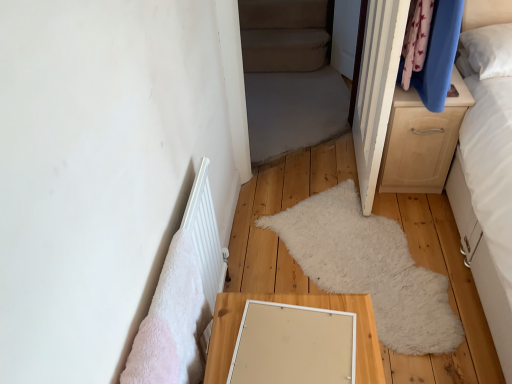
Where is `beige fabric bed at center`? beige fabric bed at center is located at coordinates (290, 76).

Where is `light wood/texture table at lower center`? This screenshot has height=384, width=512. light wood/texture table at lower center is located at coordinates tap(294, 304).

Image resolution: width=512 pixels, height=384 pixels. Describe the element at coordinates (206, 235) in the screenshot. I see `white matte radiator at lower left` at that location.

Find the location of a particular element. This screenshot has width=512, height=384. white wood door at upper right is located at coordinates (376, 89).

Measure the distance between point (428, 120) and camera.

A distance of 1.89 meters exists between point (428, 120) and camera.

This screenshot has width=512, height=384. What are the coordinates of `light wood/texture chest of drawers at right` in the screenshot? It's located at (421, 141).

Where is `wooden floor mat at center`? wooden floor mat at center is located at coordinates (448, 294).

Where is `white fluffy mat at center`? This screenshot has height=384, width=512. white fluffy mat at center is located at coordinates (369, 268).

Image resolution: width=512 pixels, height=384 pixels. I want to click on beige fabric bed at center, so click(290, 76).

Is white matte radiator at lower left wider than light wood/texture chest of drawers at right?

In fact, white matte radiator at lower left might be narrower than light wood/texture chest of drawers at right.

Is light wood/texture chest of drawers at right located within white matte radiator at lower left?

Definitely not — light wood/texture chest of drawers at right is not inside white matte radiator at lower left.

The width and height of the screenshot is (512, 384). I want to click on the chest of drawers lying above the white matte radiator at lower left (from the image's perspective), so click(x=421, y=141).

Which of these two, white matte radiator at lower left or light wood/texture chest of drawers at right, is bigger?

light wood/texture chest of drawers at right is bigger.

From a real-world perspective, between light wood/texture chest of drawers at right and white wood door at upper right, who is vertically lower?

In real-world perspective, light wood/texture chest of drawers at right is lower.

From the picture: Considering the relative positions of light wood/texture chest of drawers at right and white wood door at upper right in the image provided, is light wood/texture chest of drawers at right to the right of white wood door at upper right from the viewer's perspective?

Correct, you'll find light wood/texture chest of drawers at right to the right of white wood door at upper right.

Where is `the chest of drawers lying behind the white wood door at upper right`? The height and width of the screenshot is (384, 512). the chest of drawers lying behind the white wood door at upper right is located at coordinates (421, 141).

Considering the positions of objects white matte radiator at lower left and beige fabric bed at center in the image provided, who is more to the right, white matte radiator at lower left or beige fabric bed at center?

beige fabric bed at center.

Considering the relative sizes of white matte radiator at lower left and beige fabric bed at center in the image provided, is white matte radiator at lower left taller than beige fabric bed at center?

No.

Between white matte radiator at lower left and beige fabric bed at center, which one has larger width?

Wider between the two is beige fabric bed at center.

The width and height of the screenshot is (512, 384). There is a white matte radiator at lower left. Find the location of `bed frame above it (from a real-world perspective)`. bed frame above it (from a real-world perspective) is located at coordinates (290, 76).

Considering the relative positions of white wood door at upper right and light wood/texture table at lower center in the image provided, is white wood door at upper right to the left of light wood/texture table at lower center from the viewer's perspective?

Incorrect, white wood door at upper right is not on the left side of light wood/texture table at lower center.

Is white wood door at upper right next to light wood/texture table at lower center and touching it?

white wood door at upper right is not next to light wood/texture table at lower center, and they're not touching.

At what (x,y) coordinates should I click in order to perform the action: click on table that appears below the white wood door at upper right (from the image's perspective). Please return your answer as a coordinate pair (x, y). Looking at the image, I should click on (294, 304).

Would you say white wood door at upper right is inside or outside light wood/texture table at lower center?

white wood door at upper right exists outside the volume of light wood/texture table at lower center.

Who is smaller, beige fabric bed at center or light wood/texture table at lower center?

Result: Smaller between the two is light wood/texture table at lower center.

Identify the location of table on the left of beige fabric bed at center. (294, 304).

Considering the points (284, 70) and (216, 346), which point is in front, point (284, 70) or point (216, 346)?

The point (216, 346) is in front.

Is light wood/texture table at lower center positioned before white fluffy mat at center?

Yes, light wood/texture table at lower center is closer to the camera.

From the image's perspective, which is below, light wood/texture table at lower center or white fluffy mat at center?

light wood/texture table at lower center, from the image's perspective.

Find the location of `mat that appears above the light wood/texture table at lower center (from the image's perspective)`. mat that appears above the light wood/texture table at lower center (from the image's perspective) is located at coordinates (369, 268).

Find the location of a particular element. hardwood in front of the white fluffy mat at center is located at coordinates (448, 294).

Is white fluffy mat at center at the right side of wooden floor mat at center?

No.

Can you tell me how much white fluffy mat at center and wooden floor mat at center differ in facing direction?

There is a 88.3-degree angle between the facing directions of white fluffy mat at center and wooden floor mat at center.

From the image's perspective, between white fluffy mat at center and wooden floor mat at center, who is located below?

white fluffy mat at center, from the image's perspective.

Where is `the chest of drawers located behind the white matte radiator at lower left`? the chest of drawers located behind the white matte radiator at lower left is located at coordinates (421, 141).

Find the location of a particular element. This screenshot has height=384, width=512. door above the light wood/texture chest of drawers at right (from the image's perspective) is located at coordinates (376, 89).

Looking at the image, which one is located closer to light wood/texture chest of drawers at right, white wood door at upper right or wooden floor mat at center?

white wood door at upper right.

Looking at the image, which one is located closer to wooden floor mat at center, light wood/texture chest of drawers at right or beige fabric bed at center?

light wood/texture chest of drawers at right lies closer to wooden floor mat at center than the other object.

Looking at the image, which one is located further to beige fabric bed at center, white matte radiator at lower left or light wood/texture chest of drawers at right?

white matte radiator at lower left is further to beige fabric bed at center.

From the picture: Based on their spatial positions, is white wood door at upper right or light wood/texture table at lower center further from beige fabric bed at center?

light wood/texture table at lower center lies further to beige fabric bed at center than the other object.

Considering their positions, is light wood/texture chest of drawers at right positioned closer to white fluffy mat at center than white matte radiator at lower left?

Among the two, light wood/texture chest of drawers at right is located nearer to white fluffy mat at center.

Considering their positions, is beige fabric bed at center positioned further to white fluffy mat at center than light wood/texture table at lower center?

Among the two, beige fabric bed at center is located further to white fluffy mat at center.

From the image, which object appears to be nearer to light wood/texture chest of drawers at right, light wood/texture table at lower center or white wood door at upper right?

white wood door at upper right is closer to light wood/texture chest of drawers at right.

From the image, which object appears to be farther from beige fabric bed at center, white wood door at upper right or light wood/texture chest of drawers at right?

light wood/texture chest of drawers at right is positioned further to the anchor beige fabric bed at center.

Where is `radiator between beige fabric bed at center and light wood/texture table at lower center vertically`? radiator between beige fabric bed at center and light wood/texture table at lower center vertically is located at coordinates tap(206, 235).

Where is `mat between light wood/texture chest of drawers at right and light wood/texture table at lower center from top to bottom`? Image resolution: width=512 pixels, height=384 pixels. mat between light wood/texture chest of drawers at right and light wood/texture table at lower center from top to bottom is located at coordinates (369, 268).

Find the location of a particular element. door located between white matte radiator at lower left and light wood/texture chest of drawers at right in the left-right direction is located at coordinates (376, 89).

What are the coordinates of `radiator between white wood door at upper right and light wood/texture table at lower center from top to bottom` in the screenshot? It's located at click(x=206, y=235).